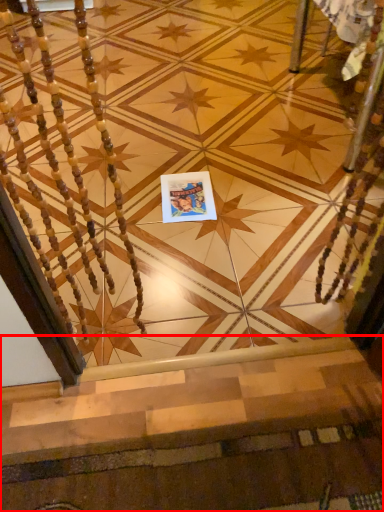
Question: In this image, where is stairs (annotated by the red box) located relative to postcard?

Choices:
 (A) left
 (B) right

Answer: (B)